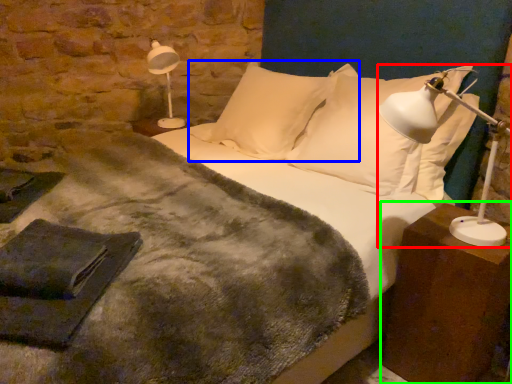
Question: Considering the real-world distances, which object is farthest from table lamp (highlighted by a red box)? pillow (highlighted by a blue box) or nightstand (highlighted by a green box)?

Choices:
 (A) pillow
 (B) nightstand

Answer: (A)